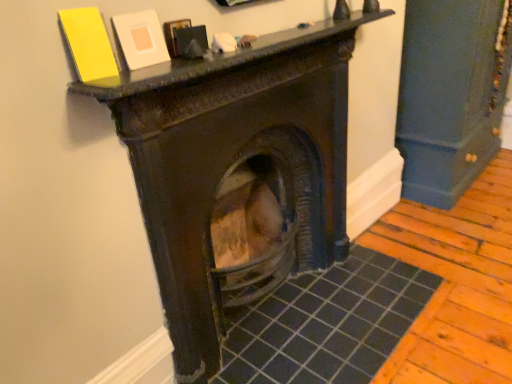
Locate an element on the screen. dark brown wood fireplace at center is located at coordinates (237, 163).

What do you see at coordinates (237, 163) in the screenshot? The height and width of the screenshot is (384, 512). I see `dark brown wood fireplace at center` at bounding box center [237, 163].

In order to face dark brown wood fireplace at center, should I rotate leftwards or rightwards?

Rotate your view left by about 1.287°.

What is the approximate width of dark brown wood fireplace at center?

33.11 centimeters.

Image resolution: width=512 pixels, height=384 pixels. Find the location of `dark brown wood fireplace at center`. dark brown wood fireplace at center is located at coordinates (237, 163).